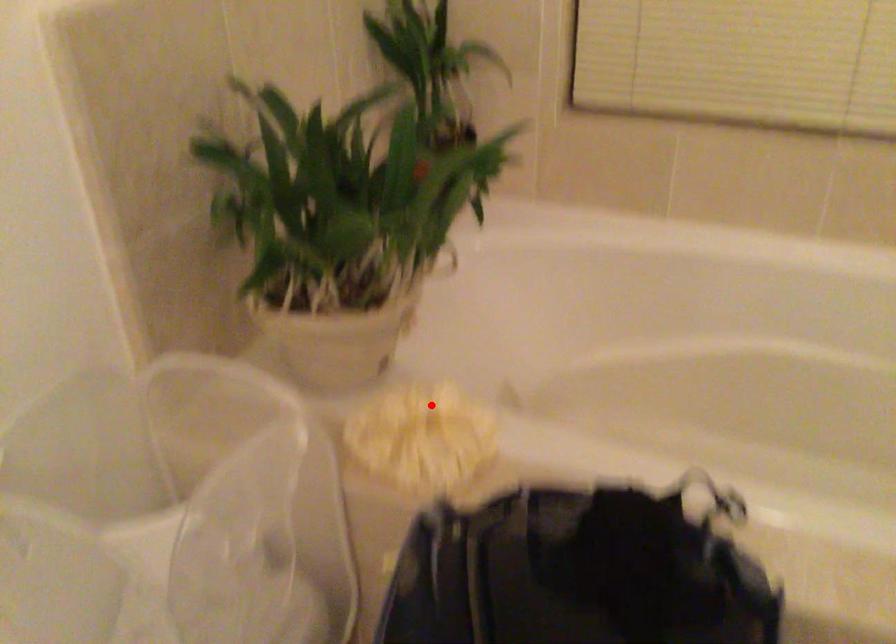
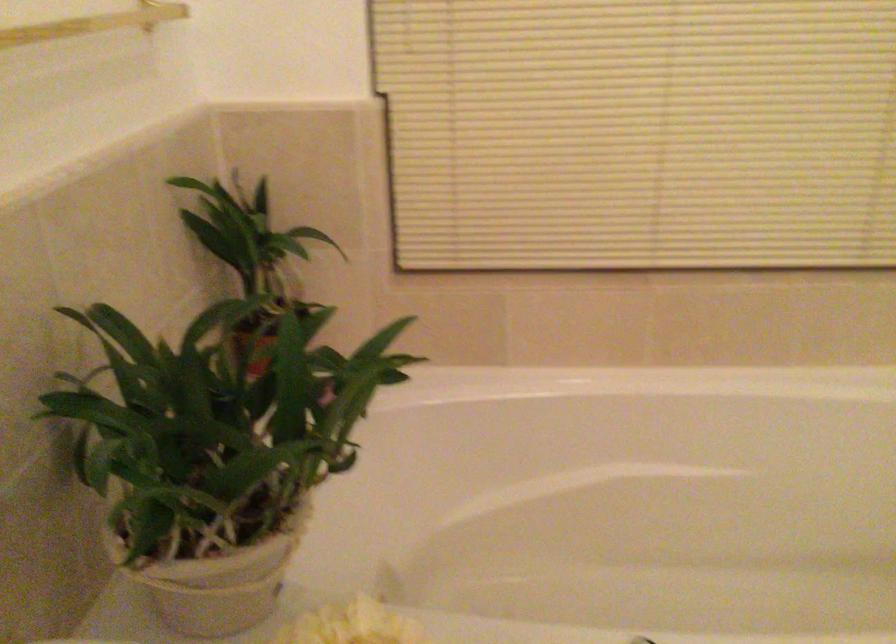
Question: I am providing you with two images of the same scene from different viewpoints. In image1, a red point is highlighted. Considering the same 3D point in image2, which of the following is correct?

Choices:
 (A) It is closer
 (B) It is farther

Answer: (A)